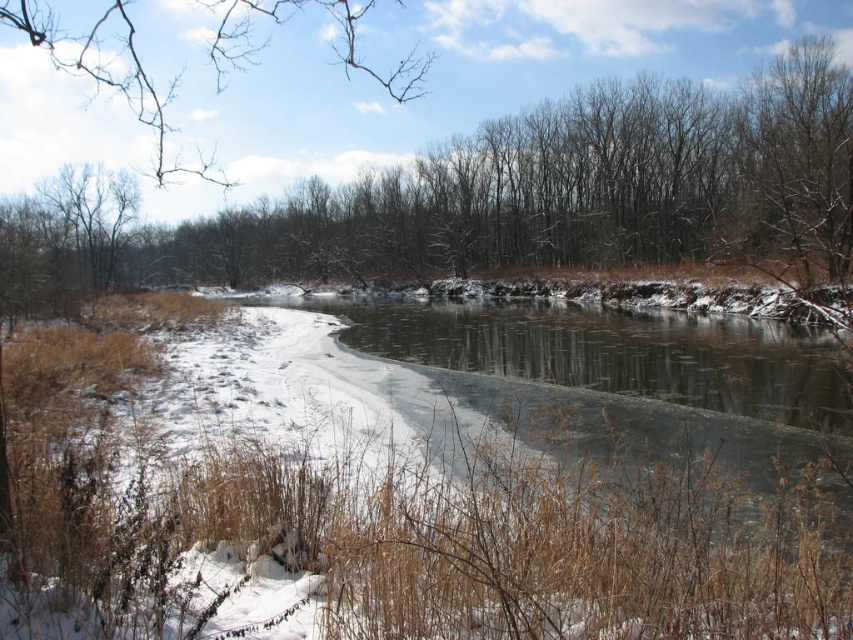
Question: Can you confirm if brown leafless trees at center is positioned above bare branches at upper left?

Choices:
 (A) yes
 (B) no

Answer: (B)

Question: Does brown leafless trees at center come behind bare branches at upper left?

Choices:
 (A) yes
 (B) no

Answer: (A)

Question: Is brown leafless trees at center to the left of bare branches at upper left from the viewer's perspective?

Choices:
 (A) yes
 (B) no

Answer: (B)